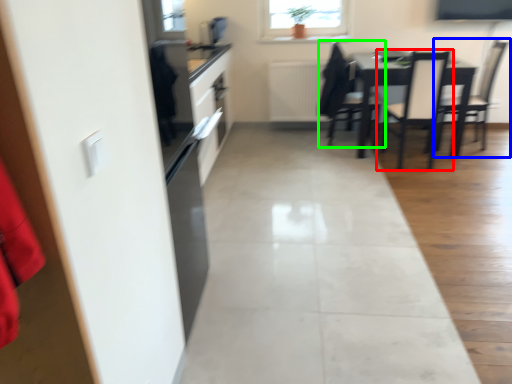
Question: Based on their relative distances, which object is farther from chair (highlighted by a red box)? Choose from chair (highlighted by a blue box) and chair (highlighted by a green box).

Choices:
 (A) chair
 (B) chair

Answer: (B)